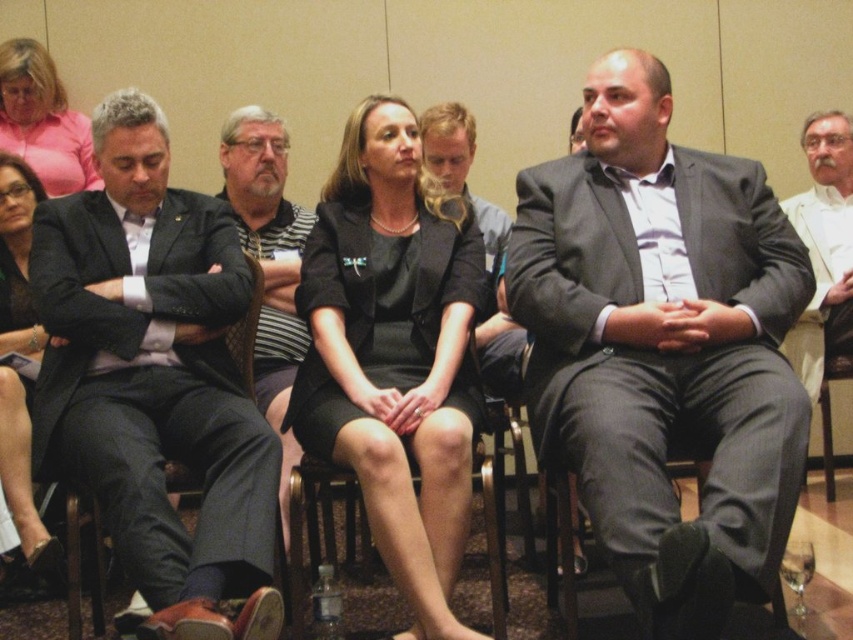
Question: Does gray suit at center appear on the right side of smooth gray suit at center?

Choices:
 (A) no
 (B) yes

Answer: (B)

Question: Which point is farther to the camera?

Choices:
 (A) (38, 566)
 (B) (639, 566)
 (C) (251, 241)

Answer: (C)

Question: Can you confirm if dark gray suit at left is positioned to the right of white textured suit at center?

Choices:
 (A) yes
 (B) no

Answer: (B)

Question: Can you confirm if dark gray suit at left is positioned below white textured suit at center?

Choices:
 (A) yes
 (B) no

Answer: (A)

Question: Which of the following is the farthest from the observer?

Choices:
 (A) dark gray suit at left
 (B) matte black dress at center
 (C) smooth gray suit at center
 (D) white textured suit at center

Answer: (D)

Question: Which point is closer to the camera?

Choices:
 (A) white textured suit at center
 (B) smooth gray suit at center
 (C) gray suit at center
 (D) dark gray suit at left

Answer: (C)